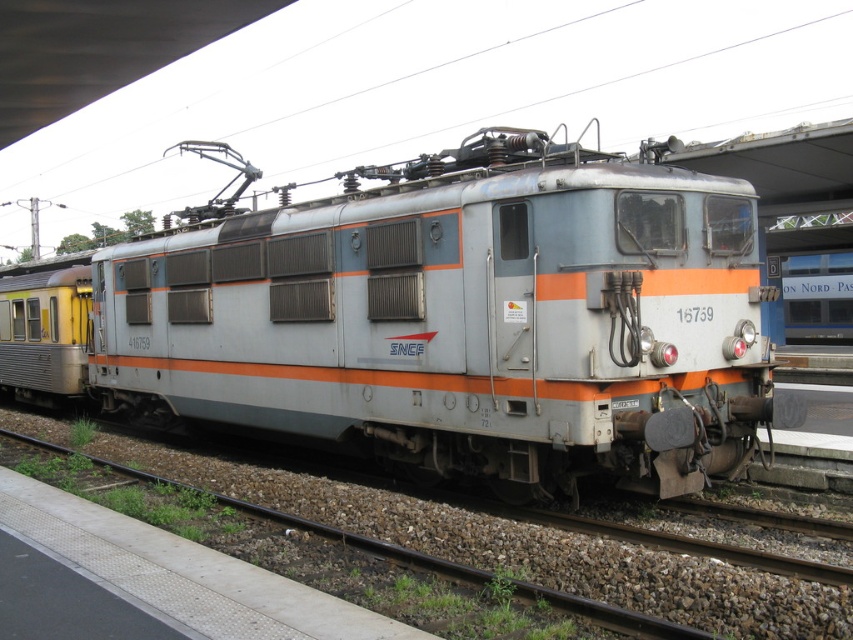
You are a railway inspector checking the platform layout. You need to ensure that the yellow matte train car at left and the silver metallic train at center are positioned correctly. Based on their heights, which train car should be placed on the lower platform level to avoid blocking the view of the SNCF logo?

The yellow matte train car at left is much taller than the silver metallic train at center, so placing the yellow matte train car at left on the lower platform level would block the view of the SNCF logo. Therefore, the silver metallic train at center should be placed on the lower platform level to avoid obstructing the logo.

You are a railway inspector checking the height of two trains at the platform. You have a height restriction of 4 meters. The matte silver train at center is much taller than the silver metallic train at center. Which train might exceed the height limit?

The matte silver train at center is much taller than the silver metallic train at center, so it might exceed the 4 meter height limit.